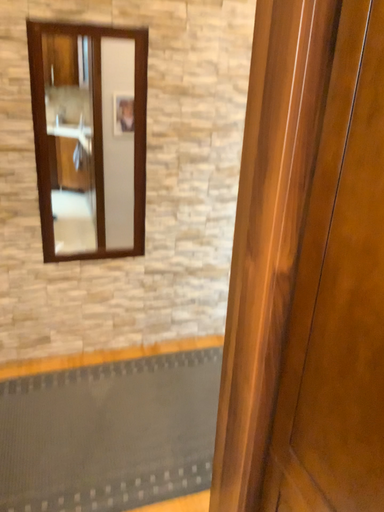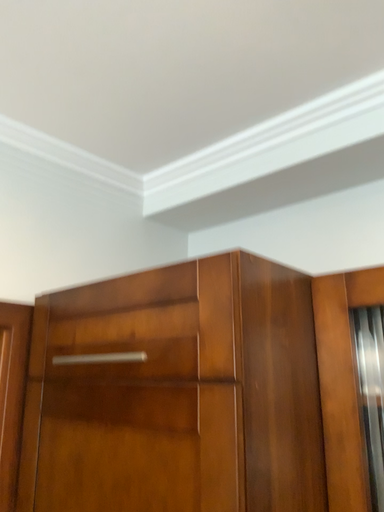
Question: Which way did the camera rotate in the video?

Choices:
 (A) rotated upward
 (B) rotated downward

Answer: (A)